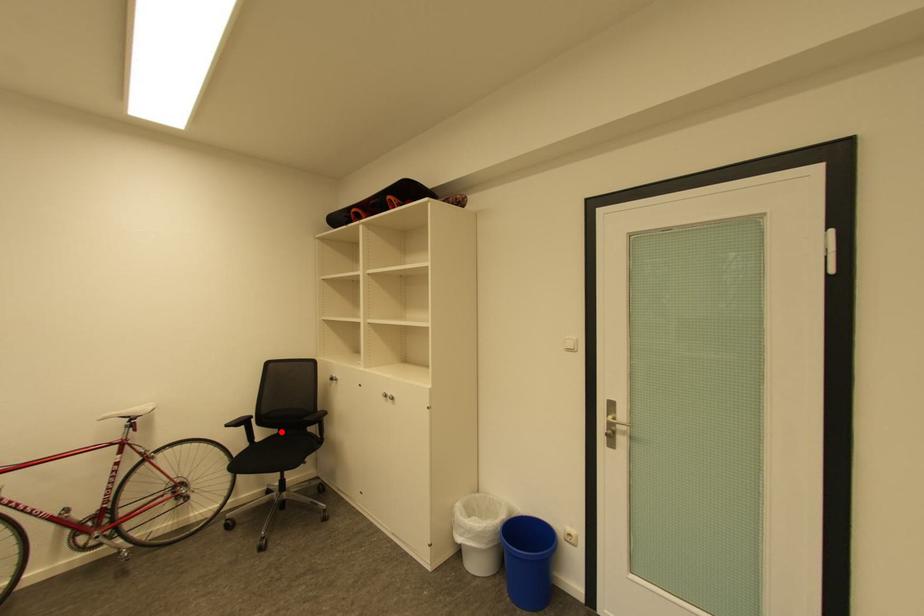
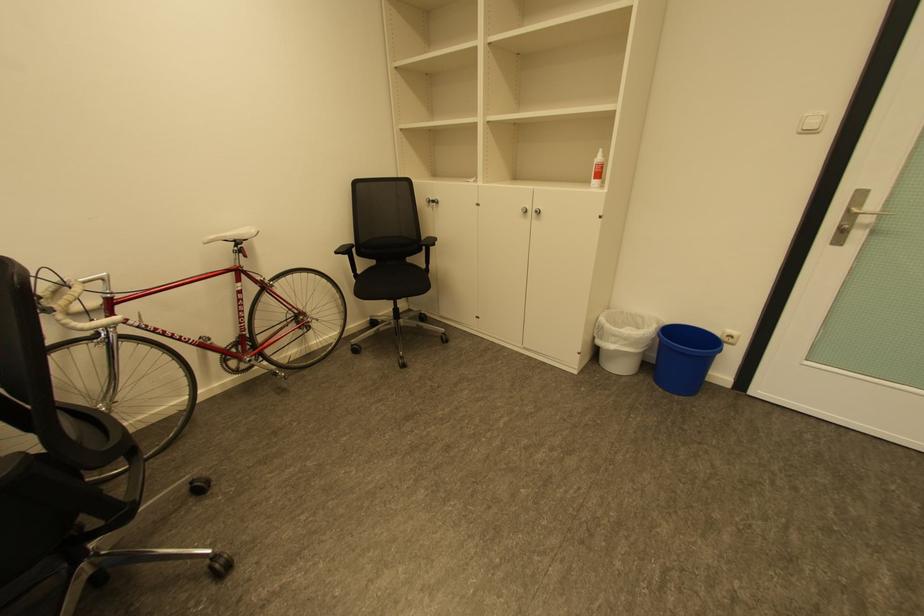
In the second image, find the point that corresponds to the highlighted location in the first image.

(380, 262)